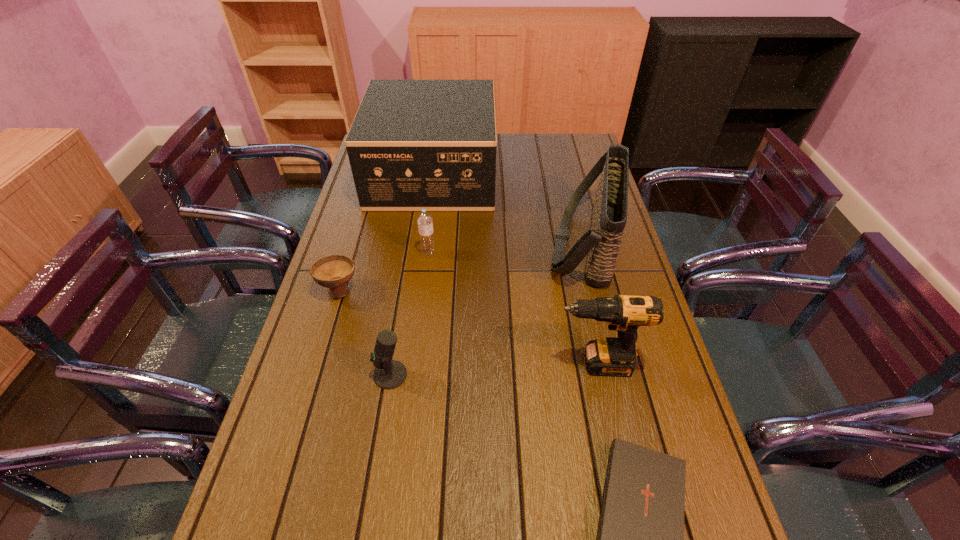
Locate an element on the screen. vacant space at the far edge of the desktop is located at coordinates (500, 146).

This screenshot has width=960, height=540. I want to click on vacant space at the left edge of the desktop, so click(x=373, y=227).

Where is `vacant region at the right edge`? vacant region at the right edge is located at coordinates (700, 474).

You are a GUI agent. You are given a task and a screenshot of the screen. Output one action in this format:
    pyautogui.click(x=<x>, y=<y>)
    Task: Click on the empty space that is in between the microphone and the sixth tallest object
    Image resolution: width=960 pixels, height=540 pixels.
    Given the screenshot: What is the action you would take?
    pyautogui.click(x=365, y=332)

Where is `free point between the drill and the box`? This screenshot has height=540, width=960. free point between the drill and the box is located at coordinates (514, 269).

In order to click on blank region between the box and the sixth tallest object in this screenshot , I will do `click(386, 232)`.

Locate an element on the screen. Image resolution: width=960 pixels, height=540 pixels. vacant area between the microphone and the drill is located at coordinates (492, 369).

This screenshot has width=960, height=540. In order to click on vacant space in between the water bottle and the box in this screenshot , I will do `click(431, 214)`.

Find the location of `object that stands as the closest to the handbag`. object that stands as the closest to the handbag is located at coordinates (414, 144).

Identify the location of object that stands as the closest to the soup bowl. This screenshot has height=540, width=960. (425, 221).